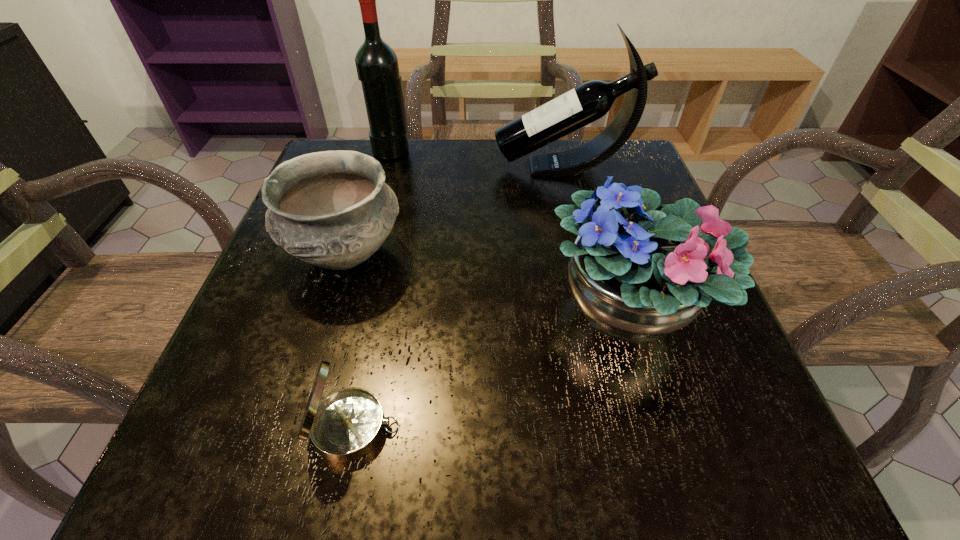
Identify which object is the fourth closest to the left wine bottle. Please provide its 2D coordinates. Your answer should be formatted as a tuple, i.e. [(x, y)], where the tuple contains the x and y coordinates of a point satisfying the conditions above.

[(345, 426)]

What are the coordinates of `vacant space that satisfies the following two spatial constraints: 1. on the stand of the second tallest object; 2. on the front side of the fourth tallest object` in the screenshot? It's located at (584, 254).

Where is `vacant area in the image that satisfies the following two spatial constraints: 1. on the back side of the left wine bottle; 2. on the right side of the pottery`? vacant area in the image that satisfies the following two spatial constraints: 1. on the back side of the left wine bottle; 2. on the right side of the pottery is located at coordinates (379, 150).